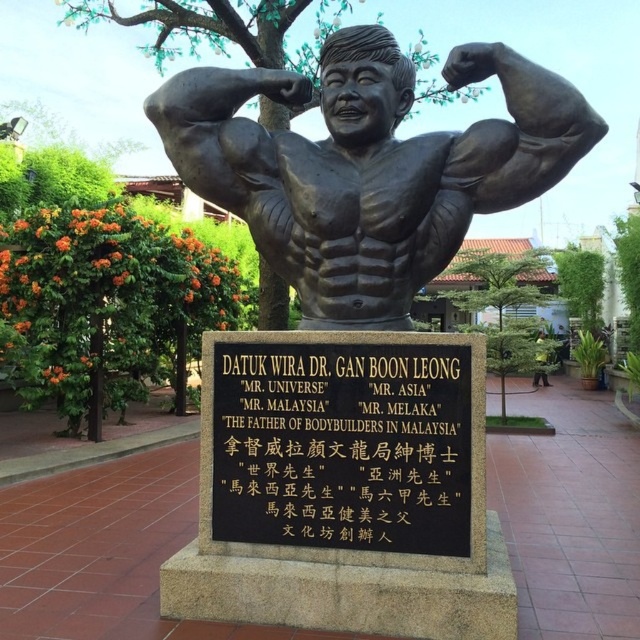
Question: Which of the following is the farthest from the observer?

Choices:
 (A) black metal plaque at center
 (B) bronze/statue at center

Answer: (B)

Question: Can you confirm if bronze statue at center is positioned above black metal plaque at center?

Choices:
 (A) yes
 (B) no

Answer: (A)

Question: Considering the real-world distances, which object is farthest from the bronze/statue at center?

Choices:
 (A) bronze statue at center
 (B) black metal plaque at center

Answer: (B)

Question: Does bronze statue at center lie behind bronze/statue at center?

Choices:
 (A) yes
 (B) no

Answer: (B)

Question: Which of the following is the closest to the observer?

Choices:
 (A) (352, 364)
 (B) (376, 173)
 (C) (440, 624)

Answer: (C)

Question: Can you confirm if bronze statue at center is wider than black metal plaque at center?

Choices:
 (A) no
 (B) yes

Answer: (B)